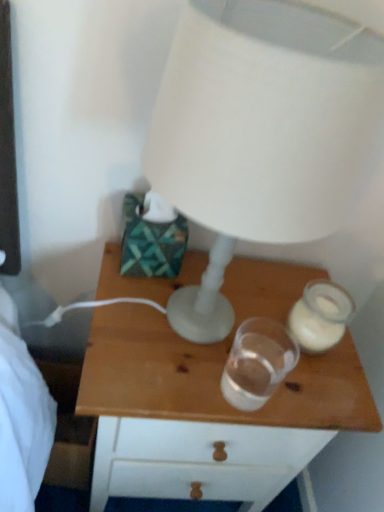
Find the location of a particular element. The height and width of the screenshot is (512, 384). vacant space to the right of transparent glass at center, positioned as the second candle holder in right-to-left order is located at coordinates (309, 390).